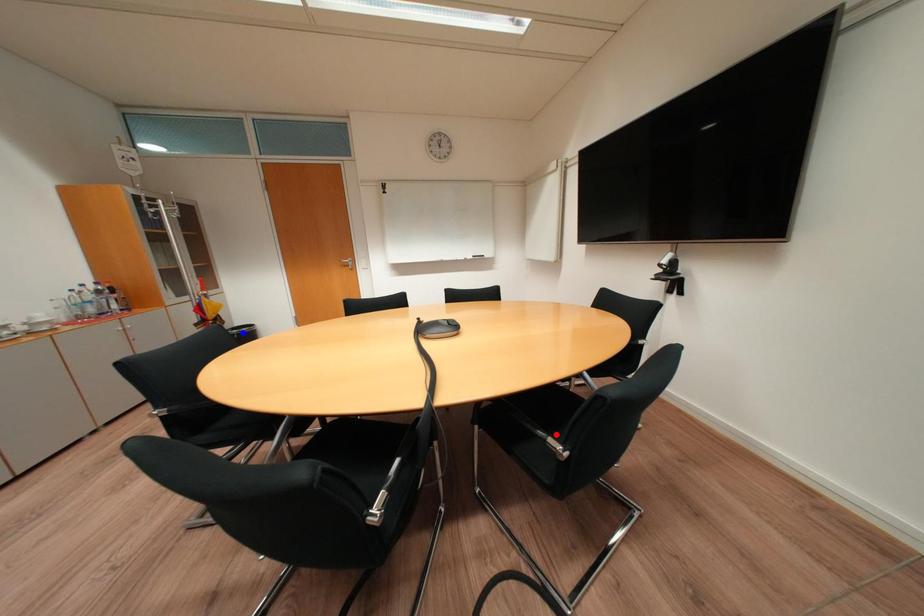
Question: In the image, two points are highlighted. Which point is nearer to the camera? Reply with the corresponding letter.

Choices:
 (A) blue point
 (B) red point

Answer: (B)